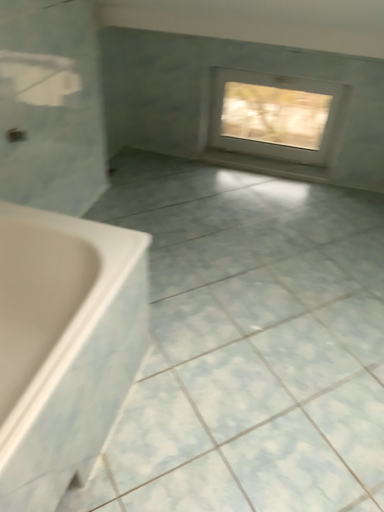
Question: From the image's perspective, is white glossy ceramic tile at center above or below white frosted glass window at upper center?

Choices:
 (A) below
 (B) above

Answer: (A)

Question: Is point (96, 505) closer or farther from the camera than point (284, 84)?

Choices:
 (A) closer
 (B) farther

Answer: (A)

Question: Estimate the real-world distances between objects in this image. Which object is closer to the white glossy ceramic tile at center?

Choices:
 (A) white plastic bathtub at lower left
 (B) white frosted glass window at upper center

Answer: (A)

Question: Estimate the real-world distances between objects in this image. Which object is closer to the white plastic bathtub at lower left?

Choices:
 (A) white frosted glass window at upper center
 (B) white glossy ceramic tile at center

Answer: (B)